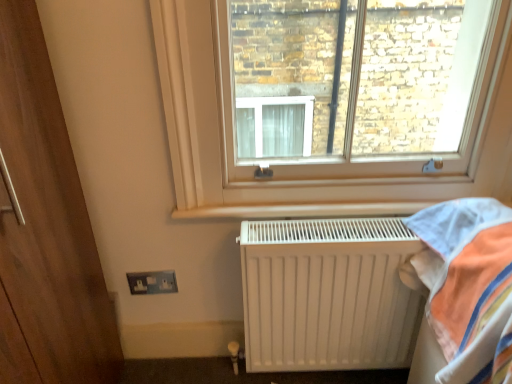
Question: Is white plastic window at upper center further to camera compared to metallic silver electrical outlet at lower left?

Choices:
 (A) no
 (B) yes

Answer: (A)

Question: Considering the relative positions of white plastic window at upper center and metallic silver electrical outlet at lower left in the image provided, is white plastic window at upper center to the right of metallic silver electrical outlet at lower left from the viewer's perspective?

Choices:
 (A) yes
 (B) no

Answer: (A)

Question: Could you tell me if white plastic window at upper center is facing metallic silver electrical outlet at lower left?

Choices:
 (A) no
 (B) yes

Answer: (A)

Question: From the image's perspective, does white plastic window at upper center appear lower than metallic silver electrical outlet at lower left?

Choices:
 (A) no
 (B) yes

Answer: (A)

Question: Is white plastic window at upper center positioned beyond the bounds of metallic silver electrical outlet at lower left?

Choices:
 (A) yes
 (B) no

Answer: (A)

Question: Can you confirm if white plastic window at upper center is thinner than metallic silver electrical outlet at lower left?

Choices:
 (A) no
 (B) yes

Answer: (A)

Question: Considering the relative sizes of white plastic window at upper center and white matte radiator at lower right in the image provided, is white plastic window at upper center thinner than white matte radiator at lower right?

Choices:
 (A) no
 (B) yes

Answer: (B)

Question: Considering the relative sizes of white plastic window at upper center and white matte radiator at lower right in the image provided, is white plastic window at upper center bigger than white matte radiator at lower right?

Choices:
 (A) no
 (B) yes

Answer: (B)

Question: From a real-world perspective, is white plastic window at upper center positioned over white matte radiator at lower right based on gravity?

Choices:
 (A) no
 (B) yes

Answer: (B)

Question: From the image's perspective, is white plastic window at upper center above white matte radiator at lower right?

Choices:
 (A) yes
 (B) no

Answer: (A)

Question: Would you say white matte radiator at lower right is part of white plastic window at upper center's contents?

Choices:
 (A) yes
 (B) no

Answer: (B)

Question: Considering the relative sizes of white plastic window at upper center and white matte radiator at lower right in the image provided, is white plastic window at upper center smaller than white matte radiator at lower right?

Choices:
 (A) no
 (B) yes

Answer: (A)

Question: Does metallic silver electrical outlet at lower left have a larger size compared to white plastic window at upper center?

Choices:
 (A) no
 (B) yes

Answer: (A)